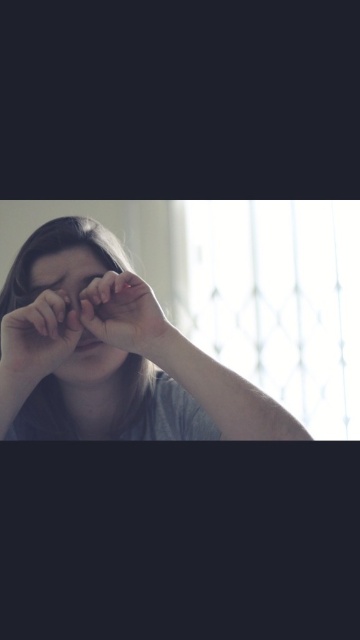
Is matte skin at center positioned before matte skin hand at center?

No, matte skin at center is further to the viewer.

Which is in front, point (83, 257) or point (159, 323)?

Point (159, 323) is in front.

You are a GUI agent. You are given a task and a screenshot of the screen. Output one action in this format:
    pyautogui.click(x=<x>, y=<y>)
    Task: Click on the matte skin at center
    This screenshot has width=360, height=640.
    Given the screenshot: What is the action you would take?
    pyautogui.click(x=77, y=312)

What do you see at coordinates (110, 353) in the screenshot? This screenshot has width=360, height=640. I see `matte gray shirt at center` at bounding box center [110, 353].

Between matte gray shirt at center and matte skin at center, which one appears on the right side from the viewer's perspective?

matte gray shirt at center

What do you see at coordinates (110, 353) in the screenshot?
I see `matte gray shirt at center` at bounding box center [110, 353].

Find the location of `matte gray shirt at center`. matte gray shirt at center is located at coordinates (110, 353).

Who is taller, matte gray shirt at center or matte black hand at lower left?

matte gray shirt at center is taller.

Does matte gray shirt at center appear on the left side of matte black hand at lower left?

Incorrect, matte gray shirt at center is not on the left side of matte black hand at lower left.

Is point (115, 259) less distant than point (0, 380)?

No, (115, 259) is behind (0, 380).

Where is `matte gray shirt at center`? The height and width of the screenshot is (640, 360). matte gray shirt at center is located at coordinates (110, 353).